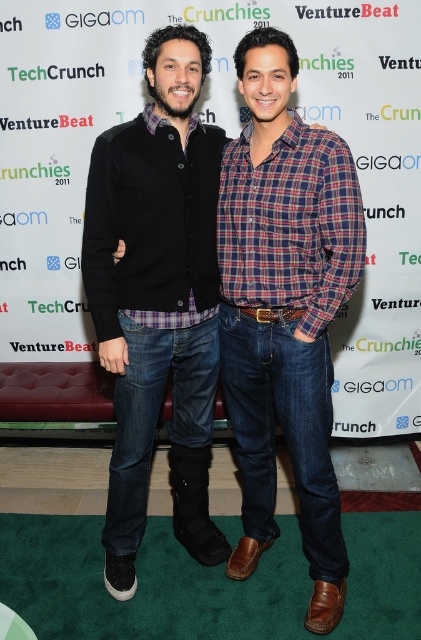
Is point (335, 186) behind point (109, 516)?

No, (335, 186) is in front of (109, 516).

Measure the distance between plaid cotton shirt at center and camera.

plaid cotton shirt at center is 4.96 feet from camera.

The width and height of the screenshot is (421, 640). Find the location of `plaid cotton shirt at center`. plaid cotton shirt at center is located at coordinates (285, 310).